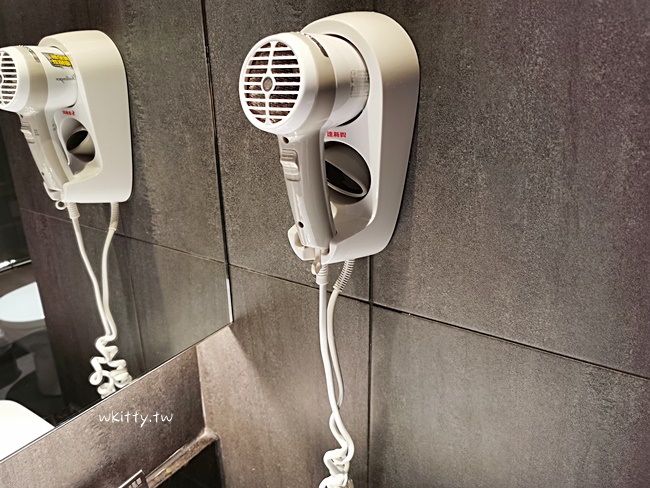
Find the location of `hair dryer`. hair dryer is located at coordinates (392, 78).